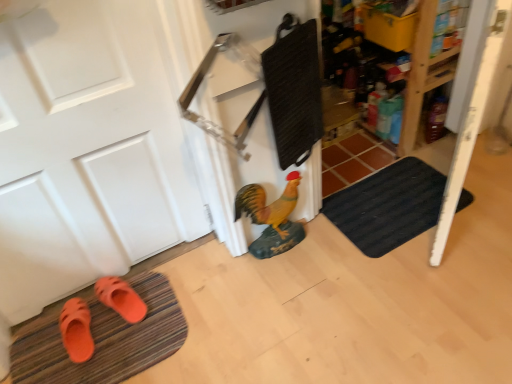
The height and width of the screenshot is (384, 512). In order to click on free location in front of orange rubber sandals at lower left, the 2th footwear viewed from the right in this screenshot , I will do `click(72, 372)`.